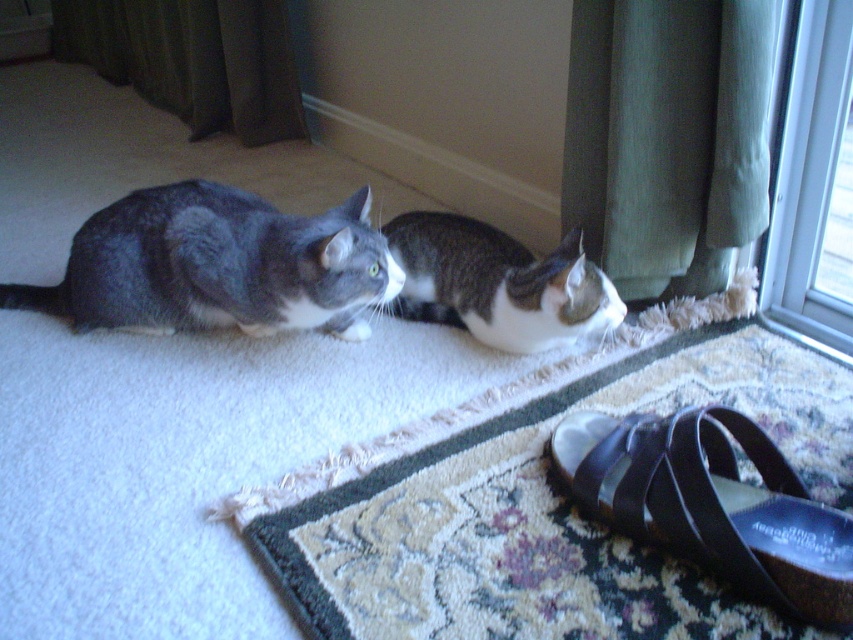
Question: Is green fabric curtain at upper right positioned in front of black leather sandal at lower right?

Choices:
 (A) yes
 (B) no

Answer: (B)

Question: Which point is farther to the camera?

Choices:
 (A) (131, 307)
 (B) (207, 65)
 (C) (728, 26)

Answer: (B)

Question: Which point is farther to the camera?

Choices:
 (A) gray fur cat at left
 (B) green fabric curtain at upper right

Answer: (A)

Question: Is black leather sandal at lower right thinner than calico fur cat at center?

Choices:
 (A) no
 (B) yes

Answer: (B)

Question: Which of these objects is positioned farthest from the transparent glass door at upper right?

Choices:
 (A) green fabric curtain at upper left
 (B) green fabric curtain at upper right

Answer: (A)

Question: Is gray fur cat at left bigger than green fabric curtain at upper left?

Choices:
 (A) yes
 (B) no

Answer: (B)